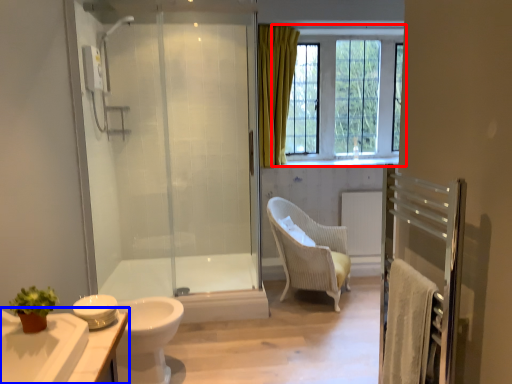
Question: Among these objects, which one is farthest to the camera, window (highlighted by a red box) or bathroom cabinet (highlighted by a blue box)?

Choices:
 (A) window
 (B) bathroom cabinet

Answer: (A)